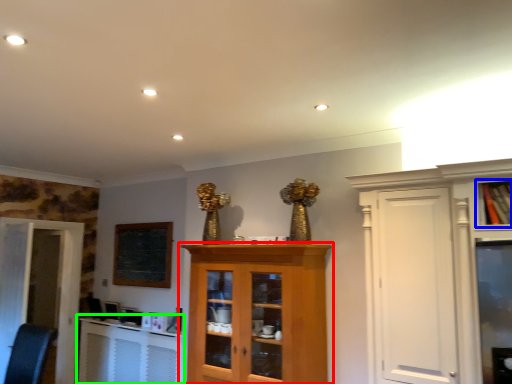
Question: Which object is the closest to the cupboard (highlighted by a red box)? Choose among these: cabinetry (highlighted by a blue box) or table (highlighted by a green box).

Choices:
 (A) cabinetry
 (B) table

Answer: (B)